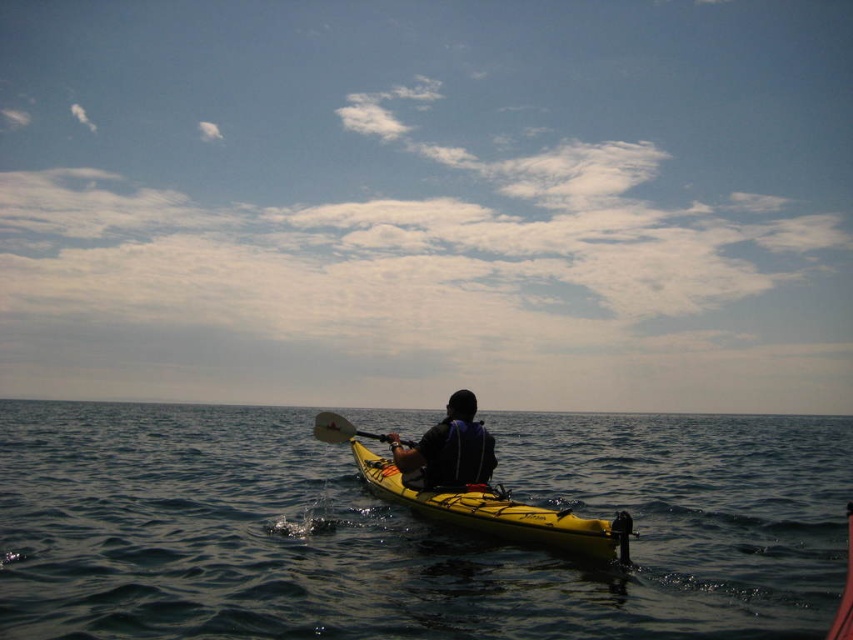
Question: Estimate the real-world distances between objects in this image. Which object is closer to the yellow matte kayak at center?

Choices:
 (A) dark blue water at center
 (B) dark blue fabric jacket at center

Answer: (B)

Question: Which of the following is the farthest from the observer?

Choices:
 (A) yellow matte paddle at center
 (B) dark blue water at center
 (C) yellow matte kayak at center

Answer: (C)

Question: From the image, what is the correct spatial relationship of yellow matte kayak at center in relation to dark blue fabric jacket at center?

Choices:
 (A) below
 (B) above

Answer: (A)

Question: Is dark blue water at center to the left of dark blue fabric jacket at center from the viewer's perspective?

Choices:
 (A) no
 (B) yes

Answer: (A)

Question: Which point is farther to the camera?

Choices:
 (A) (338, 440)
 (B) (480, 452)

Answer: (A)

Question: Can you confirm if yellow matte kayak at center is positioned to the left of yellow matte paddle at center?

Choices:
 (A) no
 (B) yes

Answer: (A)